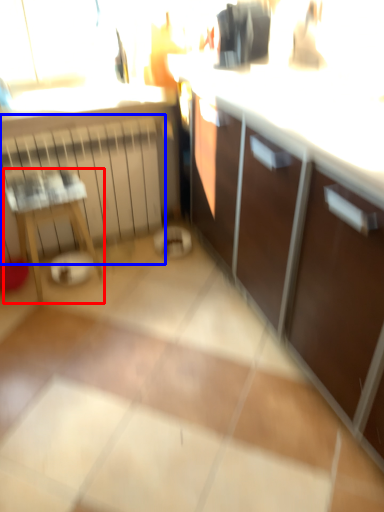
Question: Which object is further to the camera taking this photo, furniture (highlighted by a red box) or radiator (highlighted by a blue box)?

Choices:
 (A) furniture
 (B) radiator

Answer: (B)